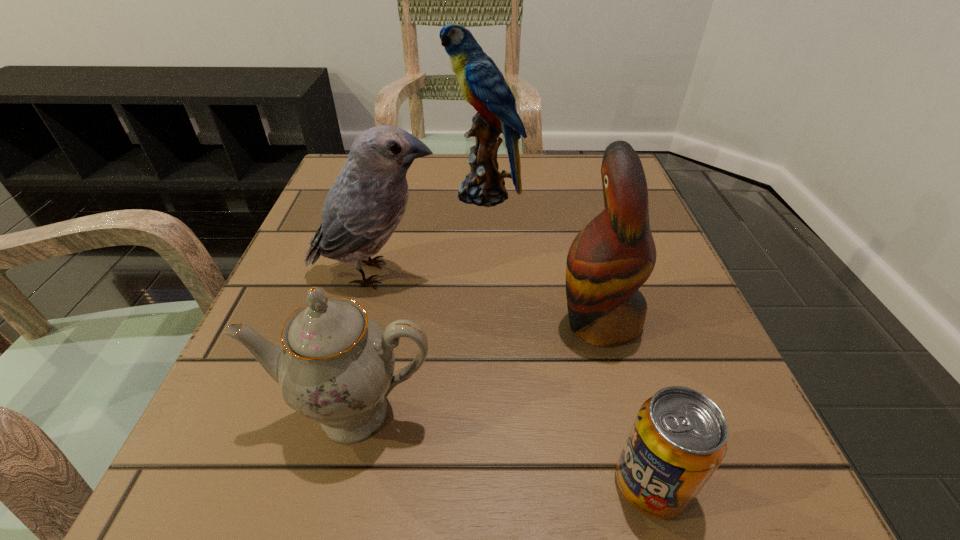
The width and height of the screenshot is (960, 540). Find the location of `parrot at the right edge`. parrot at the right edge is located at coordinates (609, 260).

In order to click on soda can that is at the right edge in this screenshot , I will do `click(679, 437)`.

Locate an element on the screen. This screenshot has height=540, width=960. object present at the near left corner is located at coordinates (336, 367).

Identify the location of object at the near right corner. The height and width of the screenshot is (540, 960). (679, 437).

In order to click on free spot at the far edge of the desktop in this screenshot , I will do `click(561, 188)`.

This screenshot has height=540, width=960. In the image, there is a desktop. What are the coordinates of `free space at the near edge` in the screenshot? It's located at (557, 516).

Where is `free space at the left edge of the desktop`? This screenshot has height=540, width=960. free space at the left edge of the desktop is located at coordinates (354, 271).

You are a GUI agent. You are given a task and a screenshot of the screen. Output one action in this format:
    pyautogui.click(x=<x>, y=<y>)
    Task: Click on the vacant space at the right edge of the desktop
    
    Given the screenshot: What is the action you would take?
    pyautogui.click(x=575, y=224)

At what (x,y) coordinates should I click in order to perform the action: click on vacant region at the near left corner of the desktop. Please return your answer as a coordinate pair (x, y). Looking at the image, I should click on (220, 512).

Where is `free area in between the soda can and the farthest object`? The image size is (960, 540). free area in between the soda can and the farthest object is located at coordinates (567, 339).